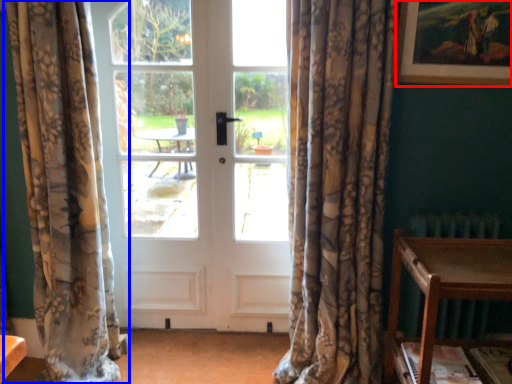
Question: Which object is further to the camera taking this photo, picture frame (highlighted by a red box) or curtain (highlighted by a blue box)?

Choices:
 (A) picture frame
 (B) curtain

Answer: (A)